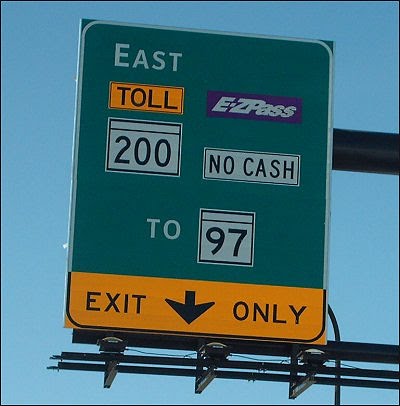
Locate an element on the screen. The height and width of the screenshot is (406, 400). electrical conduit is located at coordinates (342, 394).